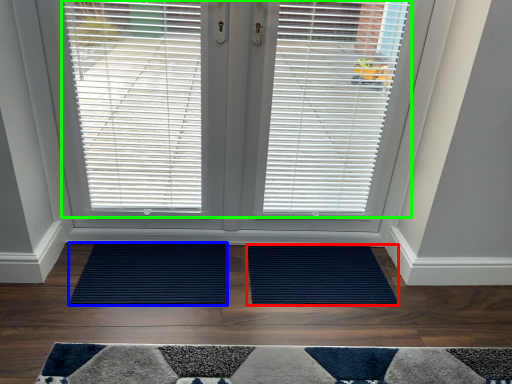
Question: Which object is the closest to the doormat (highlighted by a red box)? Choose among these: doormat (highlighted by a blue box) or window blind (highlighted by a green box).

Choices:
 (A) doormat
 (B) window blind

Answer: (A)